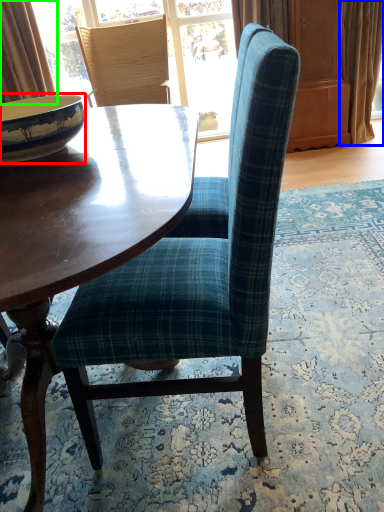
Question: Which object is the farthest from bowl (highlighted by a red box)? Choose among these: curtain (highlighted by a blue box) or curtain (highlighted by a green box).

Choices:
 (A) curtain
 (B) curtain

Answer: (A)